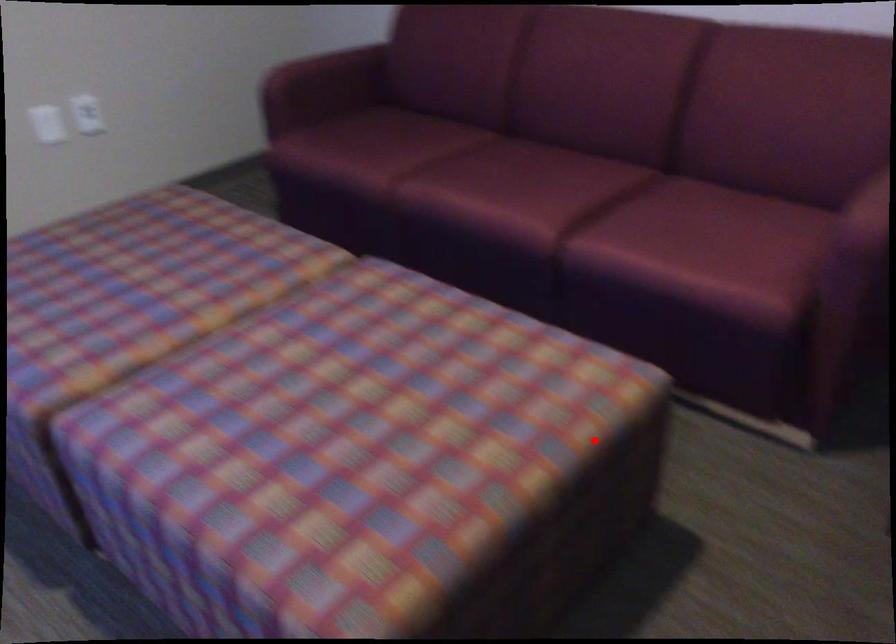
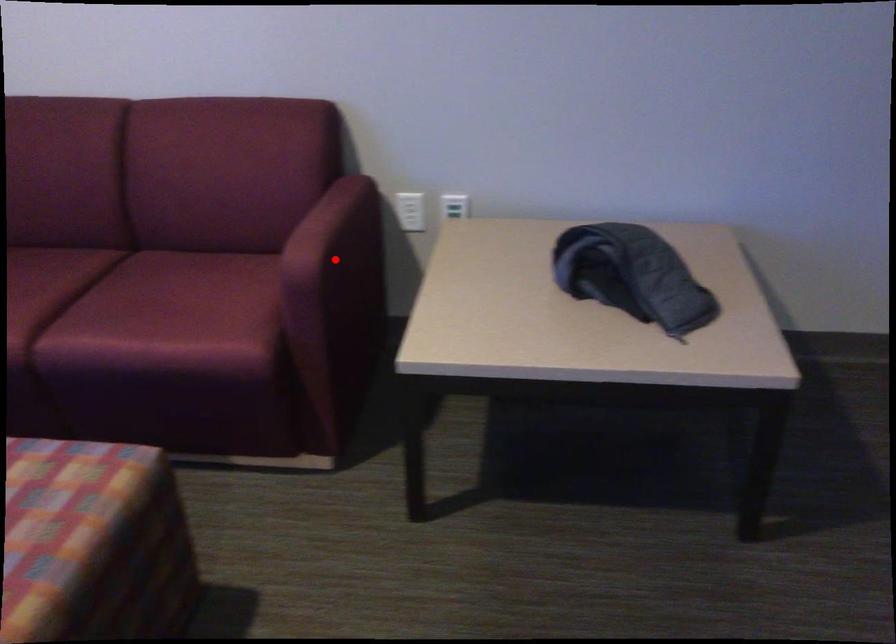
I am providing you with two images of the same scene from different viewpoints. A red point is marked on the first image and another point is marked on the second image. Does the point marked in image1 correspond to the same location as the one in image2?

No